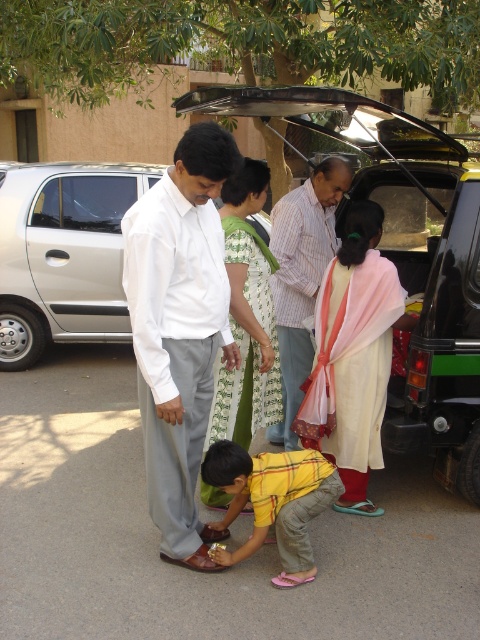
You are standing in front of the black car with its trunk open. There are two points marked on the ground near the trunk. The first point is at coordinates point (232, 138) and the second point is at point (339, 284). Which point is closer to you?

Point (232, 138) is closer to you because it is further to the viewer than point (339, 284).

From the picture: In the scene, where exactly is the yellow cotton shirt at center located in terms of coordinates?

The yellow cotton shirt at center is located at coordinates point (180, 326).